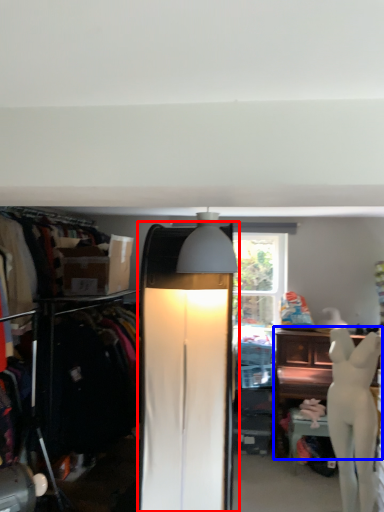
Question: Which of the following is the closest to the observer, lamp (highlighted by a red box) or furniture (highlighted by a blue box)?

Choices:
 (A) lamp
 (B) furniture

Answer: (A)